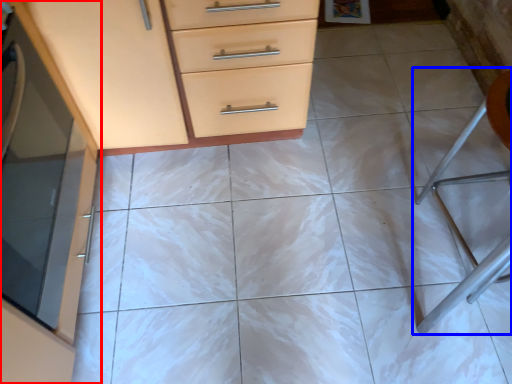
Question: Which object appears farthest to the camera in this image, cabinetry (highlighted by a red box) or folding chair (highlighted by a blue box)?

Choices:
 (A) cabinetry
 (B) folding chair

Answer: (B)